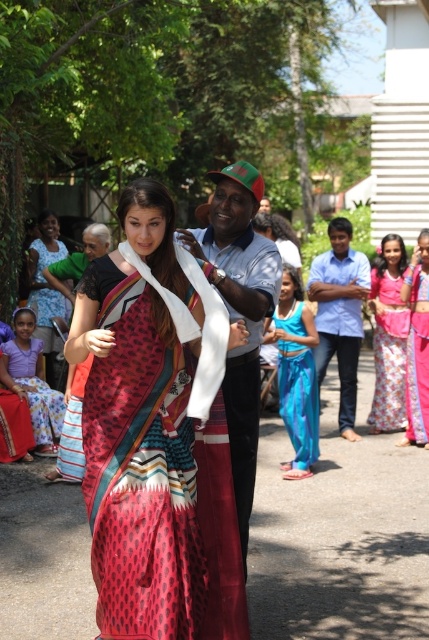
You are a photographer trying to capture the vibrant red sari and the blue shirt in the scene. Since you want both subjects in focus, which one should you adjust your camera focus on first to ensure the printed silk saree at center and the blue cotton shirt at center are both sharp?

The printed silk saree at center is closer to the viewer than the blue cotton shirt at center, so you should focus on the printed silk saree at center first. This will ensure that both objects are within the depth of field and appear sharp in the photo.

You are planning to take a photo of the two people in the scene. The blue cotton shirt at center and the matte black shirt at center are part of your composition. If you want to ensure both shirts are in focus, what is the minimum distance you should set between the camera and the subjects?

The blue cotton shirt at center and matte black shirt at center are 9.89 feet apart from each other. To ensure both are in focus, the camera should be positioned at least 9.89 feet away from the closest subject.

You are organizing a fashion show and need to arrange the floral fabric dress at center and the purple cotton dress at lower left on a runway. Which dress should be placed first if you want to maintain their original positions relative to each other as seen in the image?

The floral fabric dress at center should be placed first because it is positioned over the purple cotton dress at lower left, indicating it should be placed in front to maintain their original positions.